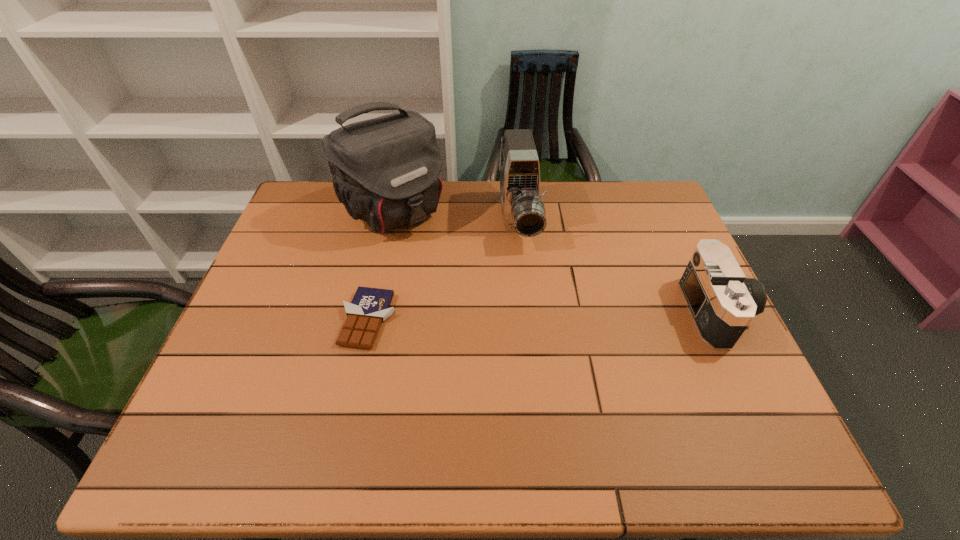
At what (x,y) coordinates should I click in order to perform the action: click on free spot between the third shortest object and the camera. Please return your answer as a coordinate pair (x, y). The width and height of the screenshot is (960, 540). Looking at the image, I should click on (618, 266).

The image size is (960, 540). What are the coordinates of `free spot between the shoulder bag and the second object from right to left` in the screenshot? It's located at (456, 216).

Locate an element on the screen. Image resolution: width=960 pixels, height=540 pixels. free space that is in between the rightmost object and the shoulder bag is located at coordinates (556, 261).

Locate an element on the screen. The width and height of the screenshot is (960, 540). vacant area that lies between the second tallest object and the second shortest object is located at coordinates (618, 266).

Where is `the closest object to the third tallest object`? The image size is (960, 540). the closest object to the third tallest object is located at coordinates (523, 211).

Locate which object is the closest to the tallest object. Please provide its 2D coordinates. Your answer should be formatted as a tuple, i.e. [(x, y)], where the tuple contains the x and y coordinates of a point satisfying the conditions above.

[(523, 211)]

This screenshot has height=540, width=960. What are the coordinates of `vacant space that satisfies the following two spatial constraints: 1. on the front side of the tallest object; 2. on the front-facing side of the second shortest object` in the screenshot? It's located at (x=371, y=312).

Image resolution: width=960 pixels, height=540 pixels. What are the coordinates of `vacant space that satisfies the following two spatial constraints: 1. on the front side of the camera; 2. on the front-facing side of the second tallest object` in the screenshot? It's located at (528, 312).

This screenshot has height=540, width=960. What are the coordinates of `free spot that satisfies the following two spatial constraints: 1. on the front side of the rightmost object; 2. on the front-facing side of the third object from left to right` in the screenshot? It's located at (528, 312).